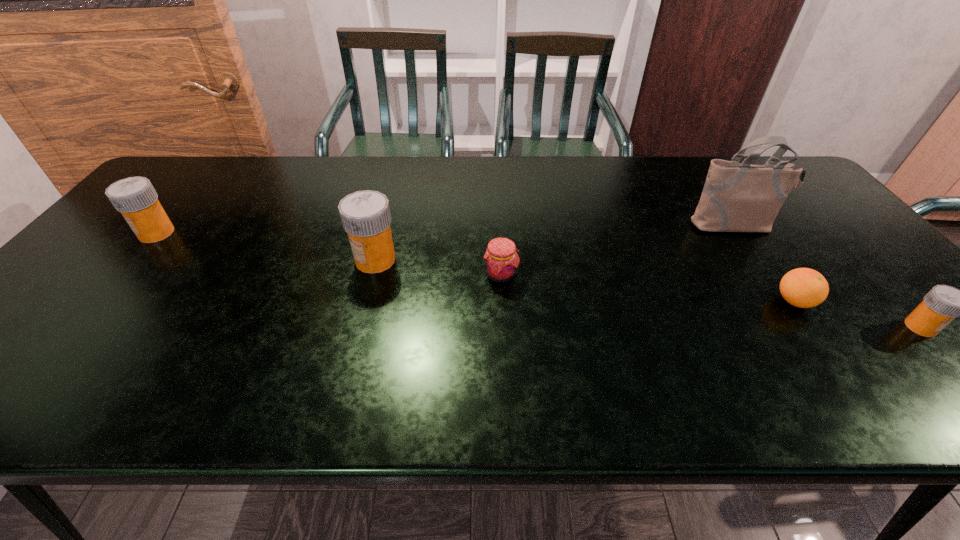
Image resolution: width=960 pixels, height=540 pixels. I want to click on the farthest medicine, so click(x=135, y=197).

You are a GUI agent. You are given a task and a screenshot of the screen. Output one action in this format:
    pyautogui.click(x=<x>, y=<y>)
    Task: Click on the leftmost medicine
    The width and height of the screenshot is (960, 540).
    Given the screenshot: What is the action you would take?
    pyautogui.click(x=135, y=197)

Image resolution: width=960 pixels, height=540 pixels. I want to click on the second medicine from right to left, so click(x=365, y=215).

You are a GUI agent. You are given a task and a screenshot of the screen. Output one action in this format:
    pyautogui.click(x=<x>, y=<y>)
    Task: Click on the second farthest medicine
    Image resolution: width=960 pixels, height=540 pixels.
    Given the screenshot: What is the action you would take?
    pyautogui.click(x=365, y=215)

Locate an element on the screen. the rightmost object is located at coordinates (942, 304).

Identify the location of the shortest medicine. The image size is (960, 540). (942, 304).

At what (x,y) coordinates should I click in order to perform the action: click on orange. Please return your answer as a coordinate pair (x, y). This screenshot has height=540, width=960. Looking at the image, I should click on (803, 287).

Where is `jam`? Image resolution: width=960 pixels, height=540 pixels. jam is located at coordinates (501, 259).

Image resolution: width=960 pixels, height=540 pixels. I want to click on the tallest object, so click(737, 197).

Where is `free location located 0.050m on the label side of the farthest medicine`? The height and width of the screenshot is (540, 960). free location located 0.050m on the label side of the farthest medicine is located at coordinates (121, 233).